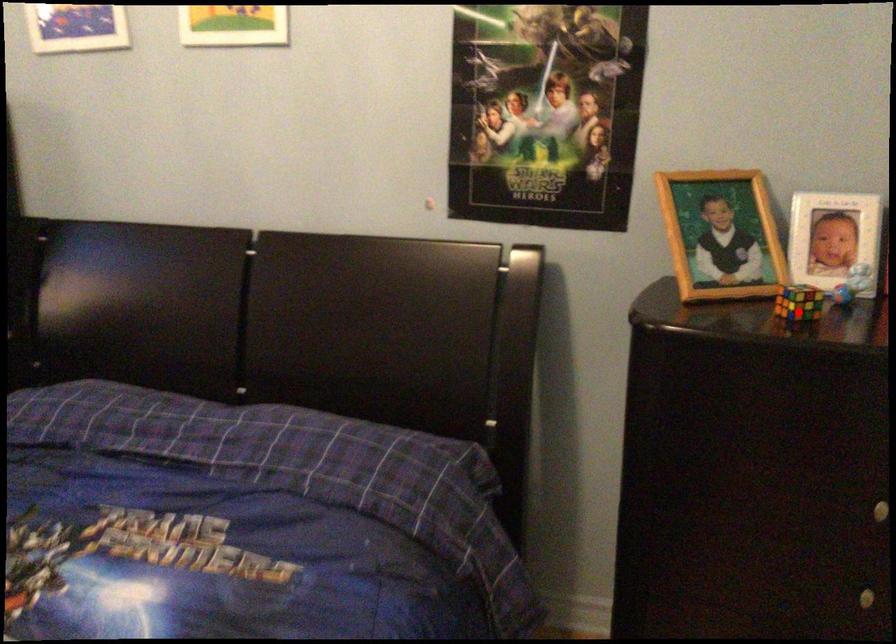
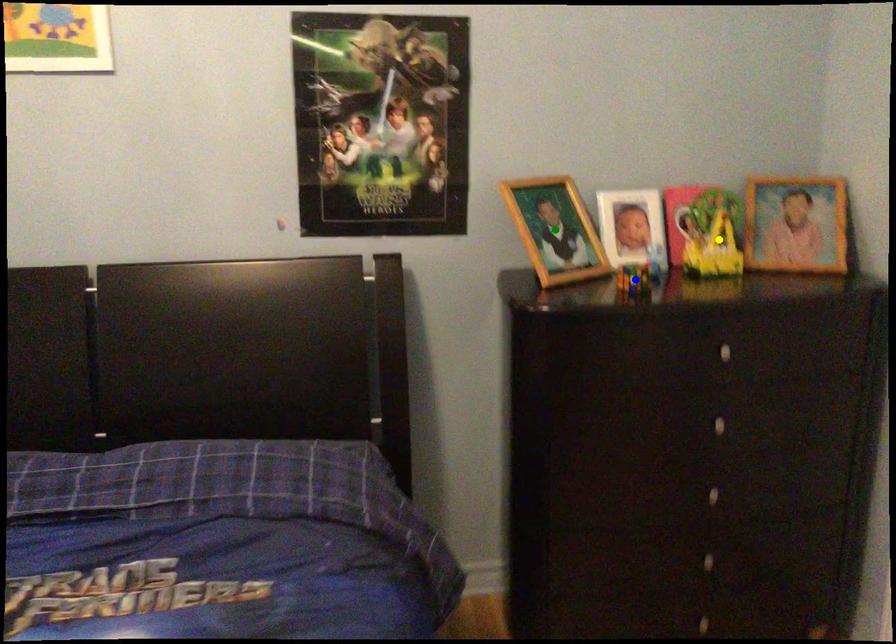
Question: I am providing you with two images of the same scene from different viewpoints. A red point is marked on the first image. You are given multiple points on the second image. Which point in image 2 is actually the same real-world point as the red point in image 1?

Choices:
 (A) yellow point
 (B) blue point
 (C) green point

Answer: (B)